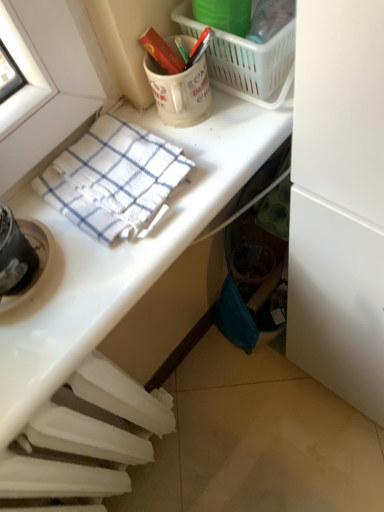
Where is `vacant region in front of white checkered towel at upper left`? vacant region in front of white checkered towel at upper left is located at coordinates (101, 287).